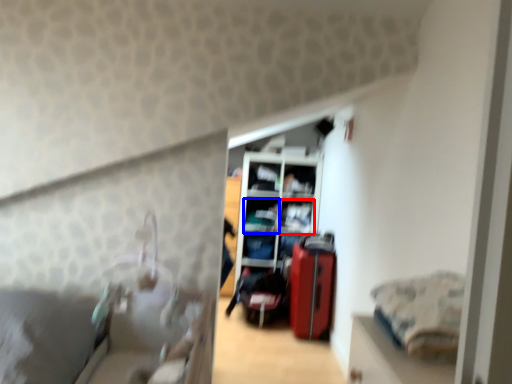
Question: Which object appears farthest to the camera in this image, shelf (highlighted by a red box) or shelf (highlighted by a blue box)?

Choices:
 (A) shelf
 (B) shelf

Answer: (B)